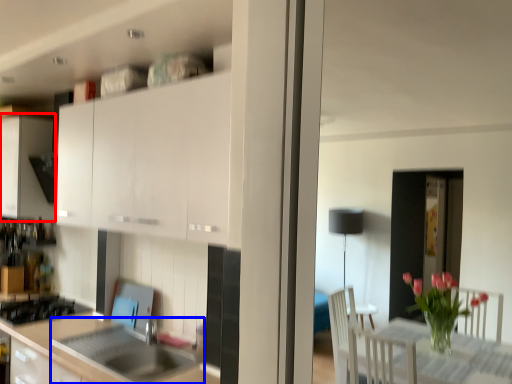
Question: Which object appears closest to the camera in this image, cabinetry (highlighted by a red box) or sink (highlighted by a blue box)?

Choices:
 (A) cabinetry
 (B) sink

Answer: (B)